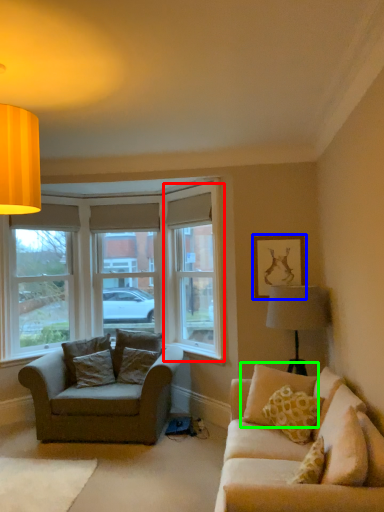
Question: Based on their relative distances, which object is farther from window screen (highlighted by a red box)? Choose from picture frame (highlighted by a blue box) and pillow (highlighted by a green box).

Choices:
 (A) picture frame
 (B) pillow

Answer: (B)